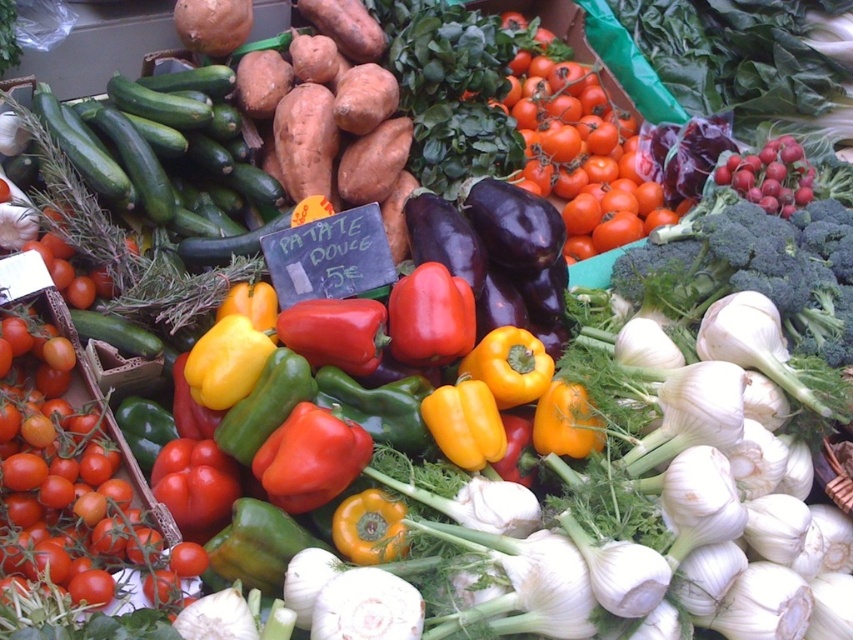
You are standing at the market stall and want to pick up two items. The first item is located at point (68, 518), and the second item is at point (535, 83). Which item should you reach for first if you want to grab the one closer to you?

You should reach for the item at point (68, 518) first because it is closer to you than the item at point (535, 83).

You are a customer at the market stall looking at the vegetables displayed. You see a point marked at coordinate [74,481]. What vegetable is located at that point?

The point at coordinate [74,481] marks a smooth red tomato at center.

You are a customer at the market stall and want to find the smooth red tomato at center. Based on the coordinates provided, where should you look relative to the bell peppers?

The smooth red tomato at center is located at point (74, 481), which means it is positioned to the right and slightly above the bell peppers in the center area of the image.